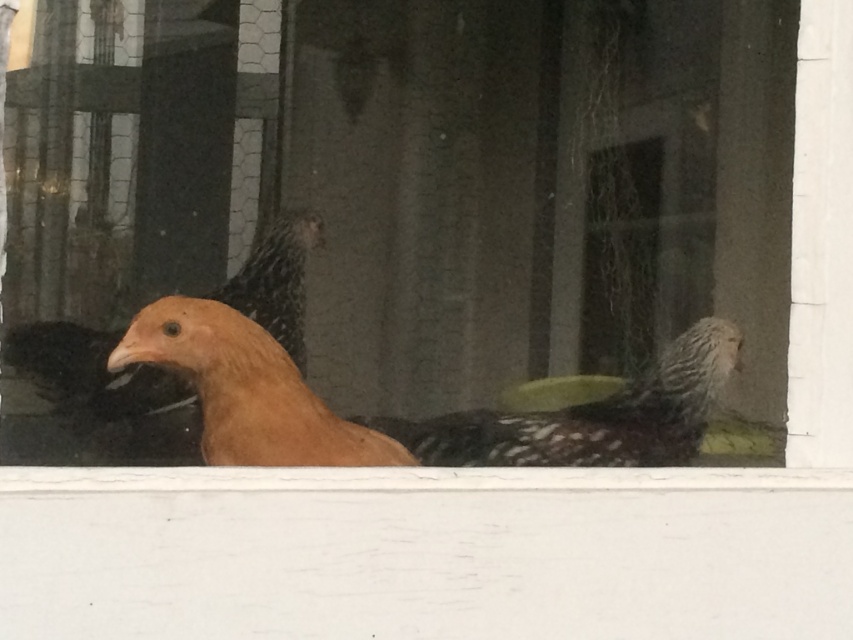
Question: Considering the real-world distances, which object is farthest from the golden feathered chicken at center?

Choices:
 (A) matte orange bird at center
 (B) matte orange chicken at center

Answer: (B)

Question: Considering the relative positions of golden feathered chicken at center and matte orange bird at center in the image provided, where is golden feathered chicken at center located with respect to matte orange bird at center?

Choices:
 (A) right
 (B) left

Answer: (A)

Question: Can you confirm if matte orange chicken at center is smaller than golden feathered chicken at center?

Choices:
 (A) no
 (B) yes

Answer: (A)

Question: Is golden feathered chicken at center closer to the viewer compared to matte orange bird at center?

Choices:
 (A) yes
 (B) no

Answer: (A)

Question: Which of the following is the farthest from the observer?

Choices:
 (A) golden feathered chicken at center
 (B) matte orange bird at center
 (C) matte orange chicken at center

Answer: (B)

Question: Which of the following is the farthest from the observer?

Choices:
 (A) matte orange bird at center
 (B) golden feathered chicken at center

Answer: (A)